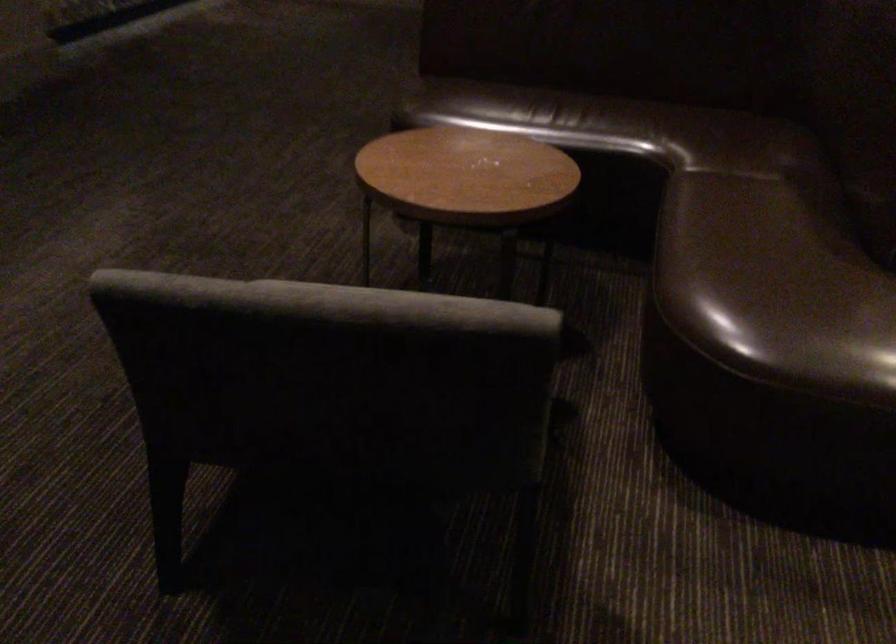
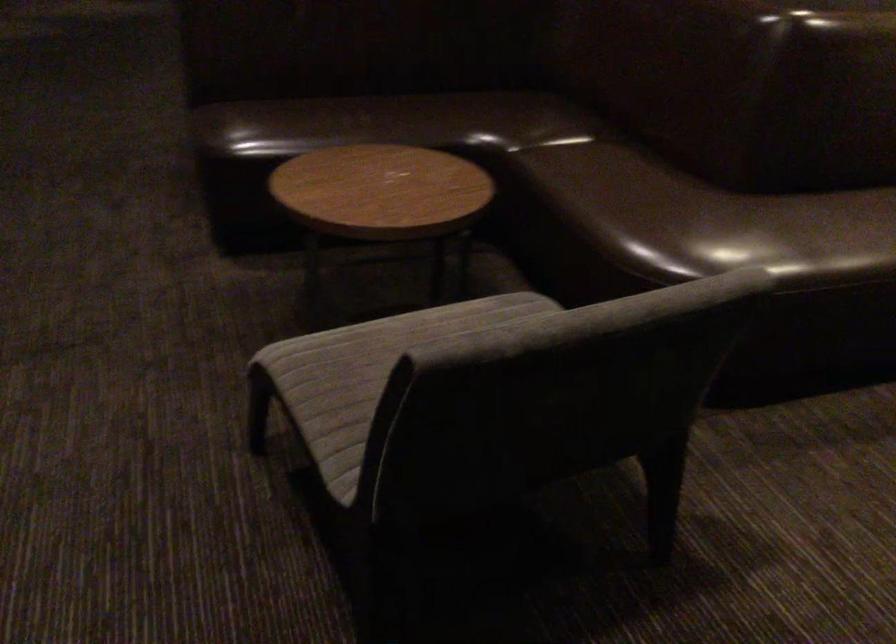
Question: The camera is either moving clockwise (left) or counter-clockwise (right) around the object. The first image is from the beginning of the video and the second image is from the end. Is the camera moving left or right when shooting the video?

Choices:
 (A) Left
 (B) Right

Answer: (A)